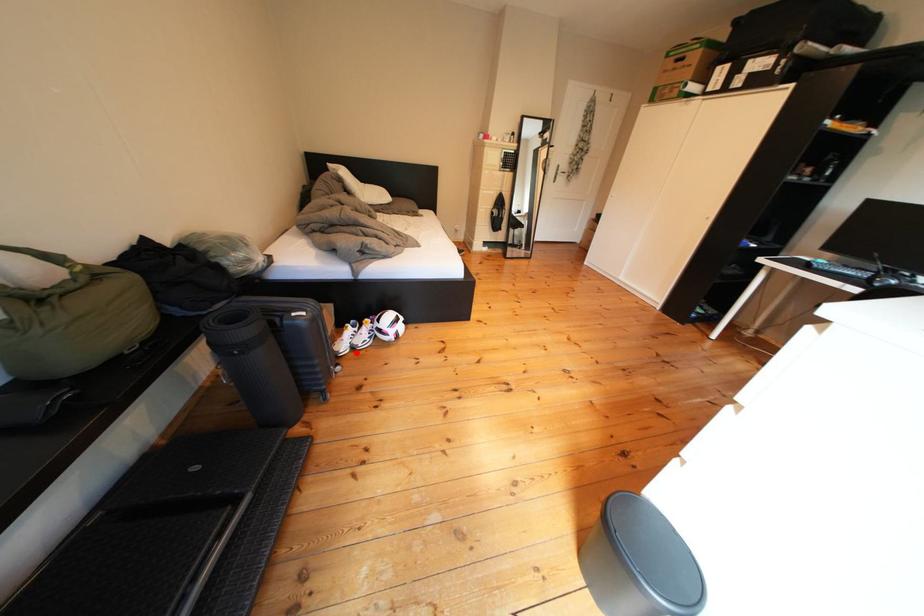
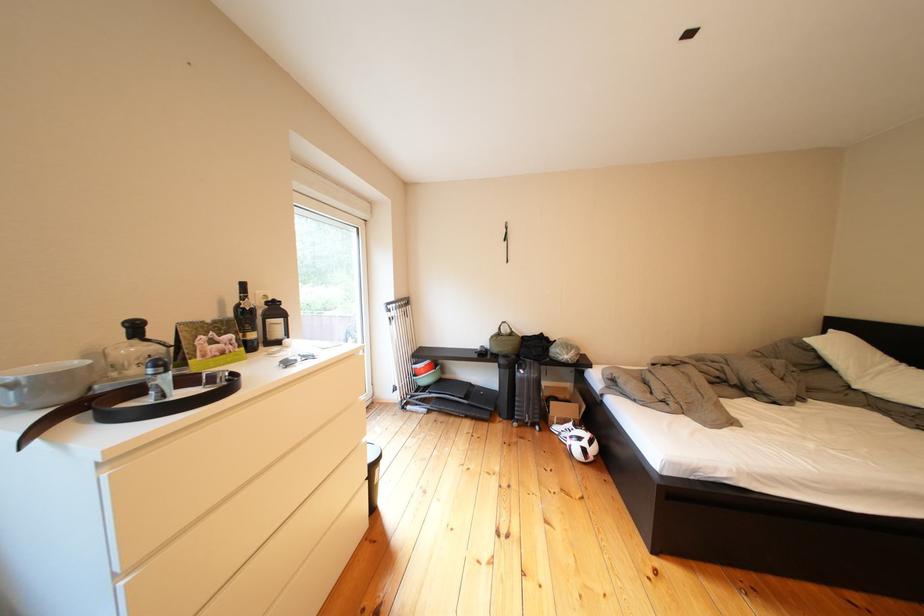
Where in the second image is the point corresponding to the highlighted location from the first image?

(570, 432)